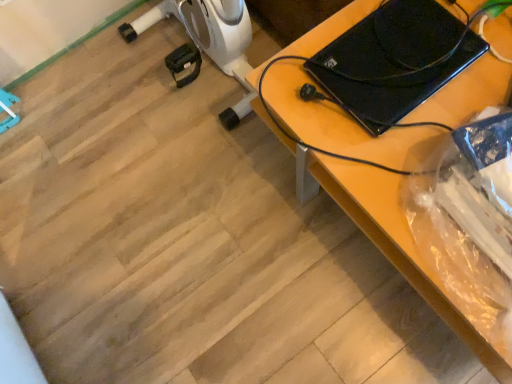
At what (x,y) coordinates should I click in order to perform the action: click on unoccupied area in front of black glossy laptop at upper right. Please return your answer as a coordinate pair (x, y). This screenshot has width=512, height=384. Looking at the image, I should click on (408, 158).